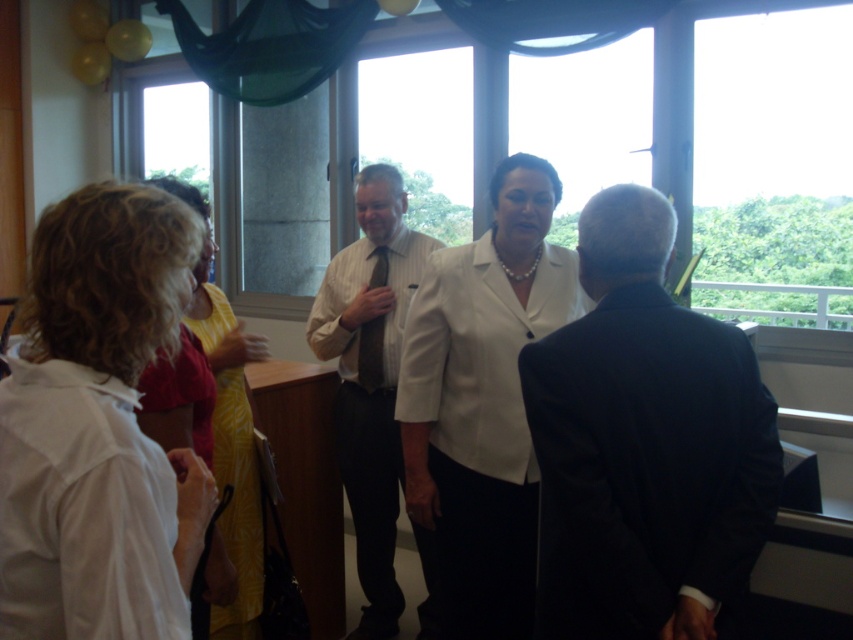
Question: Can you confirm if dark suit at center is wider than transparent glass window at center?

Choices:
 (A) yes
 (B) no

Answer: (B)

Question: Which object is the closest to the yellow floral dress at left?

Choices:
 (A) transparent glass window at upper right
 (B) white matte blazer at center
 (C) transparent glass window at center

Answer: (B)

Question: Which object appears closest to the camera in this image?

Choices:
 (A) yellow floral dress at left
 (B) white matte shirt at left
 (C) white striped shirt at center

Answer: (B)

Question: Is transparent glass window at upper right positioned at the back of white striped shirt at center?

Choices:
 (A) yes
 (B) no

Answer: (A)

Question: Among these points, which one is nearest to the camera?

Choices:
 (A) (724, 80)
 (B) (364, 310)

Answer: (B)

Question: Can you confirm if transparent glass window at center is positioned below yellow floral dress at left?

Choices:
 (A) no
 (B) yes

Answer: (A)